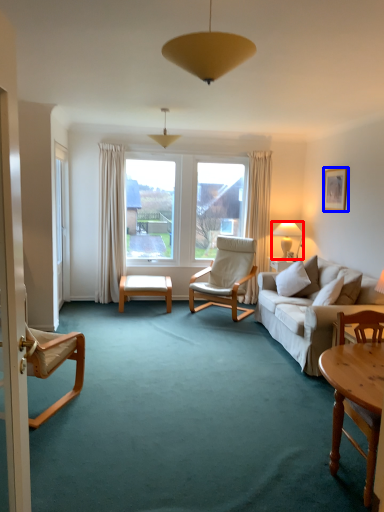
Question: Among these objects, which one is farthest to the camera, lamp (highlighted by a red box) or picture frame (highlighted by a blue box)?

Choices:
 (A) lamp
 (B) picture frame

Answer: (A)